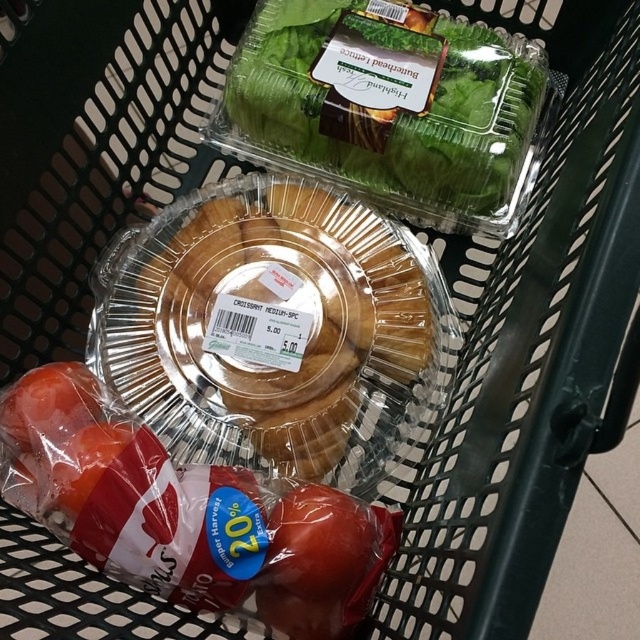
You are organizing groceries in a shopping basket. You have a clear plastic pie at center and a green leafy lettuce at upper center. Based on their positions, which item is closer to the right side of the basket?

The green leafy lettuce at upper center is closer to the right side of the basket because the clear plastic pie at center is positioned to its left.

You are a delivery person holding a 26 inch wide box. You need to place it in the shopping basket without touching any items. Can you fit it between the clear plastic pie at center and the edge of the basket?

The clear plastic pie at center is 25.76 inches away from the viewer. Since the box is 26 inches wide, it is slightly wider than the available space, so it might not fit without touching the pie or the basket edge.